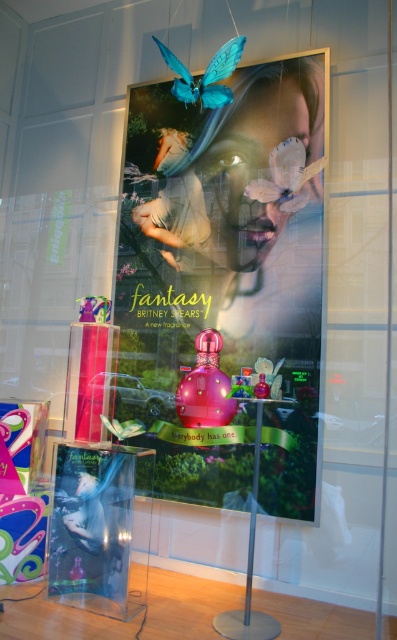
You are standing in front of the Britney Spears Fantasy fragrance display. The main poster is directly in front of you. Where would you look to find the pink glossy perfume at center?

The pink glossy perfume at center is located at the 2D coordinates point (204, 387), which is slightly to the right and center of the main poster display.

You are a store employee arranging the Britney Spears Fantasy display. You need to place a new teal matte butterfly at upper center. Where should you position it relative to the glossy plastic poster at center?

The teal matte butterfly at upper center should be placed above the glossy plastic poster at center since the glossy plastic poster at center is located below teal matte butterfly at upper center.

Based on the scene description, where is the glossy plastic poster at center located in terms of coordinates?

The glossy plastic poster at center is located at coordinates point (225,282).